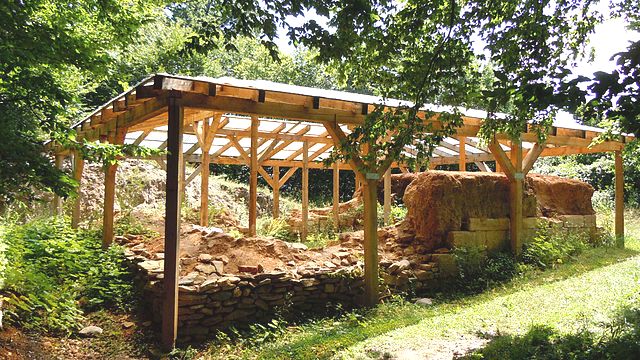
At what (x,y) coordinates should I click in order to perform the action: click on metal sign. Please return your answer as a coordinate pair (x, y). Looking at the image, I should click on (371, 173), (516, 174).